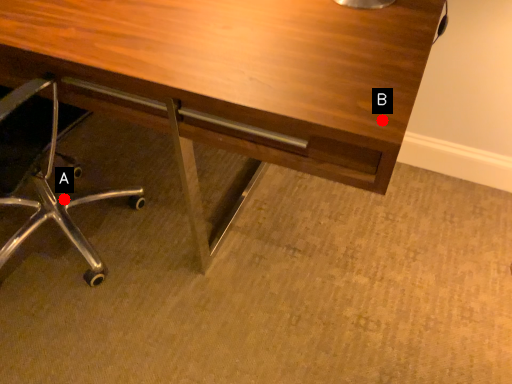
Question: Two points are circled on the image, labeled by A and B beside each circle. Which point is closer to the camera?

Choices:
 (A) A is closer
 (B) B is closer

Answer: (B)